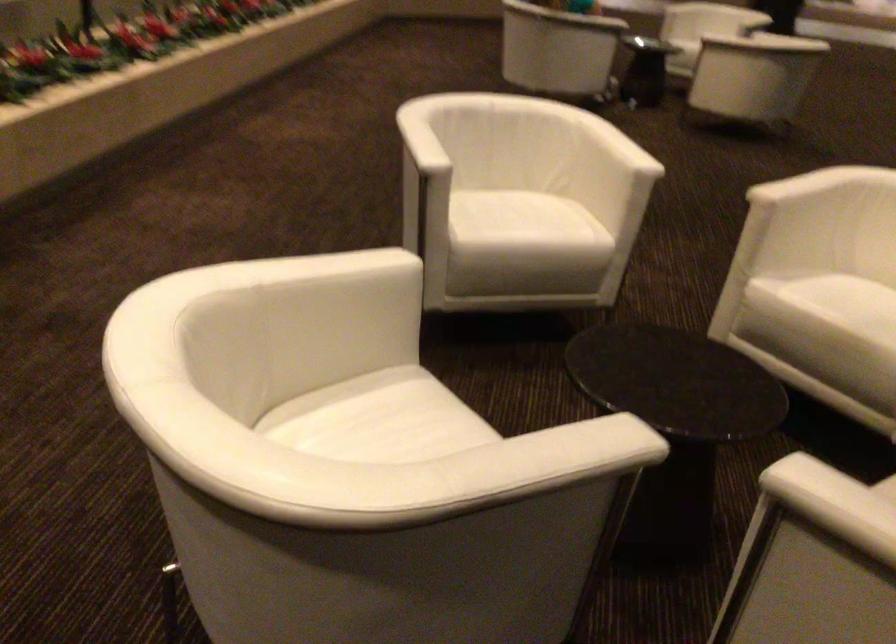
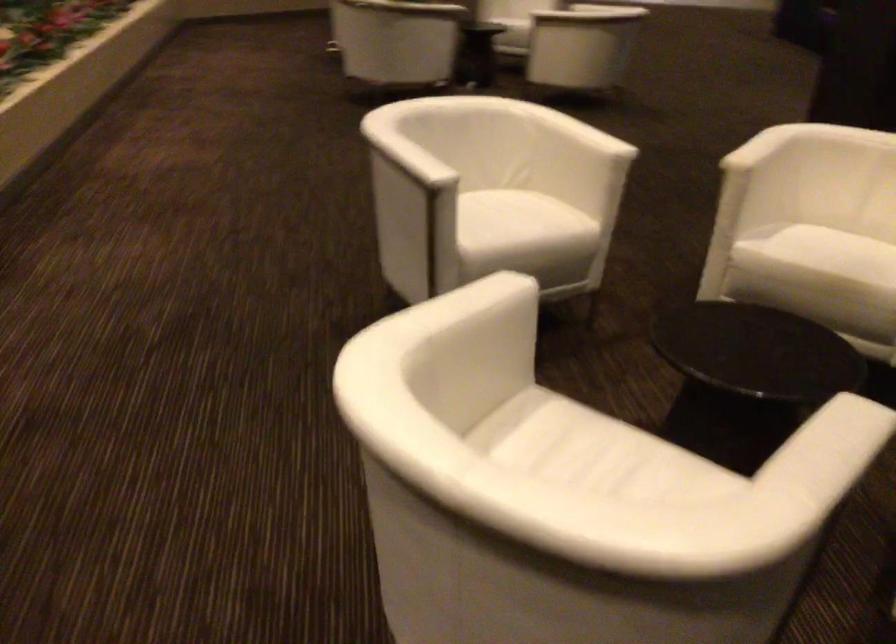
Question: How did the camera likely rotate?

Choices:
 (A) Left
 (B) Right
 (C) Up
 (D) Down

Answer: (B)